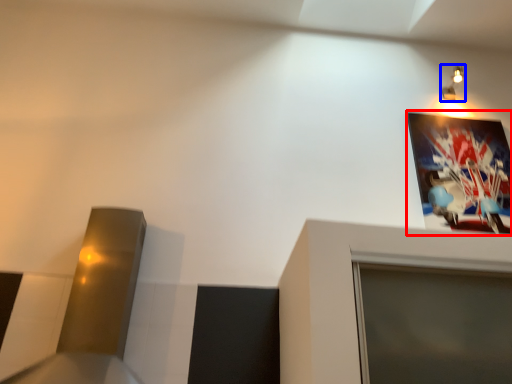
Question: Which object appears closest to the camera in this image, picture frame (highlighted by a red box) or light fixture (highlighted by a blue box)?

Choices:
 (A) picture frame
 (B) light fixture

Answer: (A)